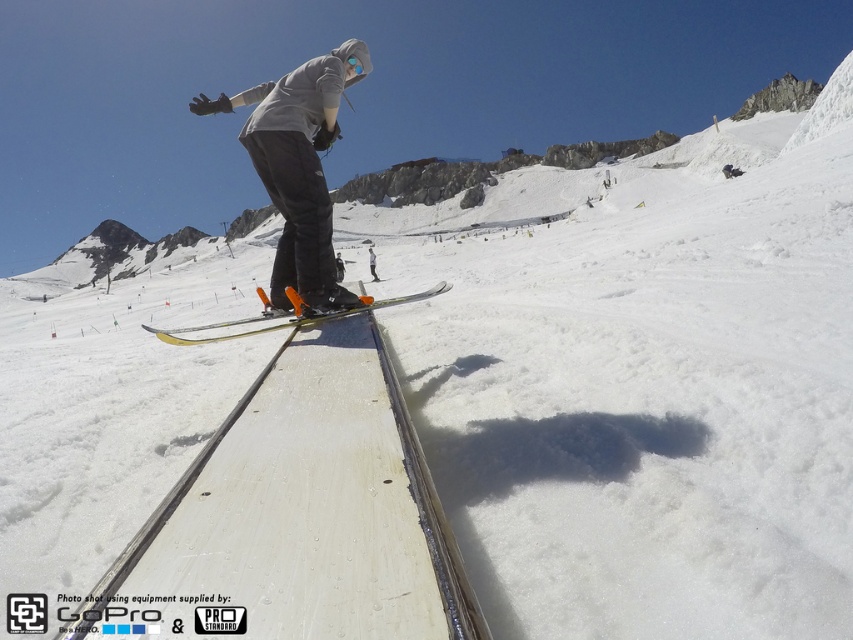
Who is lower down, gray matte hoodie at center or yellow metallic skis at center?

Positioned lower is yellow metallic skis at center.

Does point (318, 86) lie in front of point (294, 317)?

No, it is behind (294, 317).

Find the location of a particular element. The width and height of the screenshot is (853, 640). gray matte hoodie at center is located at coordinates (299, 168).

The width and height of the screenshot is (853, 640). Find the location of `gray matte hoodie at center`. gray matte hoodie at center is located at coordinates (299, 168).